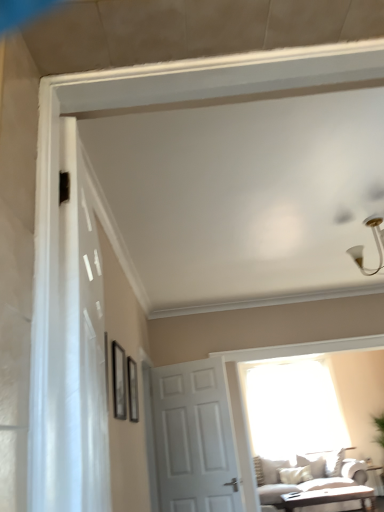
Question: Is white glossy table at lower right, which is the 1th table in back-to-front order, far from white sheer curtain at left?

Choices:
 (A) yes
 (B) no

Answer: (A)

Question: Does white glossy table at lower right, which is the 1th table in back-to-front order, appear on the left side of white sheer curtain at left?

Choices:
 (A) no
 (B) yes

Answer: (A)

Question: Is white glossy table at lower right, which appears as the second table when viewed from the left, positioned in front of white sheer curtain at left?

Choices:
 (A) no
 (B) yes

Answer: (A)

Question: Is white sheer curtain at left at the back of white glossy table at lower right, the first table positioned from the right?

Choices:
 (A) no
 (B) yes

Answer: (A)

Question: Is white glossy table at lower right, the first table positioned from the right, taller than white sheer curtain at left?

Choices:
 (A) yes
 (B) no

Answer: (B)

Question: From a real-world perspective, does white glossy table at lower right, which appears as the second table when viewed from the left, stand above white sheer curtain at left?

Choices:
 (A) no
 (B) yes

Answer: (A)

Question: Is matte black picture frame at upper center, arranged as the first picture frame when viewed from the back, outside beige fabric couch at lower right?

Choices:
 (A) no
 (B) yes

Answer: (B)

Question: Is beige fabric couch at lower right at the back of matte black picture frame at upper center, the 2th picture frame when ordered from front to back?

Choices:
 (A) no
 (B) yes

Answer: (A)

Question: Is matte black picture frame at upper center, arranged as the first picture frame when viewed from the back, wider than beige fabric couch at lower right?

Choices:
 (A) yes
 (B) no

Answer: (B)

Question: From the image's perspective, is matte black picture frame at upper center, arranged as the first picture frame when viewed from the back, located above beige fabric couch at lower right?

Choices:
 (A) no
 (B) yes

Answer: (B)

Question: Can you confirm if matte black picture frame at upper center, arranged as the first picture frame when viewed from the back, is shorter than beige fabric couch at lower right?

Choices:
 (A) no
 (B) yes

Answer: (B)

Question: Is matte black picture frame at upper center, the 2th picture frame when ordered from front to back, positioned behind beige fabric couch at lower right?

Choices:
 (A) no
 (B) yes

Answer: (A)

Question: Considering the relative sizes of white sheer curtain at left and transparent glass window at center in the image provided, is white sheer curtain at left taller than transparent glass window at center?

Choices:
 (A) no
 (B) yes

Answer: (A)